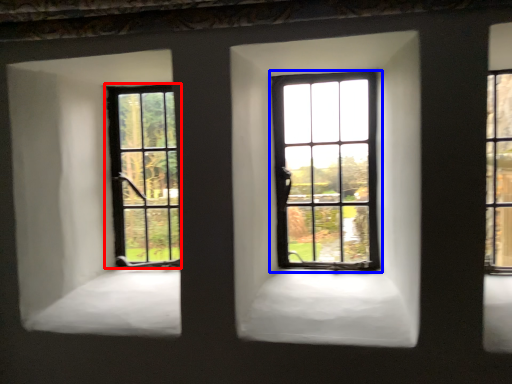
Question: Which object appears farthest to the camera in this image, window (highlighted by a red box) or window (highlighted by a blue box)?

Choices:
 (A) window
 (B) window

Answer: (A)